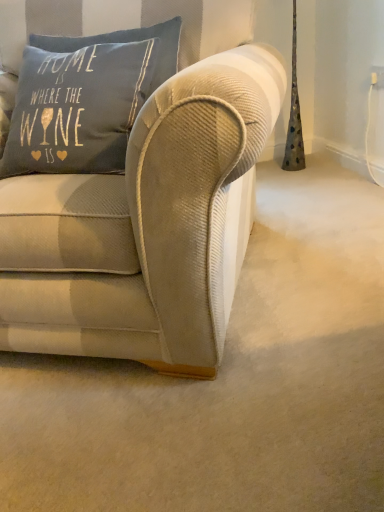
Question: In terms of width, does beige corduroy couch at center look wider or thinner when compared to textured gray pillow at upper left, which ranks as the second pillow in bottom-to-top order?

Choices:
 (A) wide
 (B) thin

Answer: (A)

Question: Based on their positions, is beige corduroy couch at center located to the left or right of textured gray pillow at upper left, which ranks as the second pillow in bottom-to-top order?

Choices:
 (A) left
 (B) right

Answer: (A)

Question: Which object is positioned farthest from the blue cotton pillow at upper left, which is the 2th pillow in top-to-bottom order?

Choices:
 (A) textured gray pillow at upper left, which is the first pillow from top to bottom
 (B) beige corduroy couch at center

Answer: (B)

Question: Which object is the closest to the textured gray pillow at upper left, which ranks as the second pillow in bottom-to-top order?

Choices:
 (A) blue cotton pillow at upper left, which is the 2th pillow in top-to-bottom order
 (B) beige corduroy couch at center

Answer: (A)